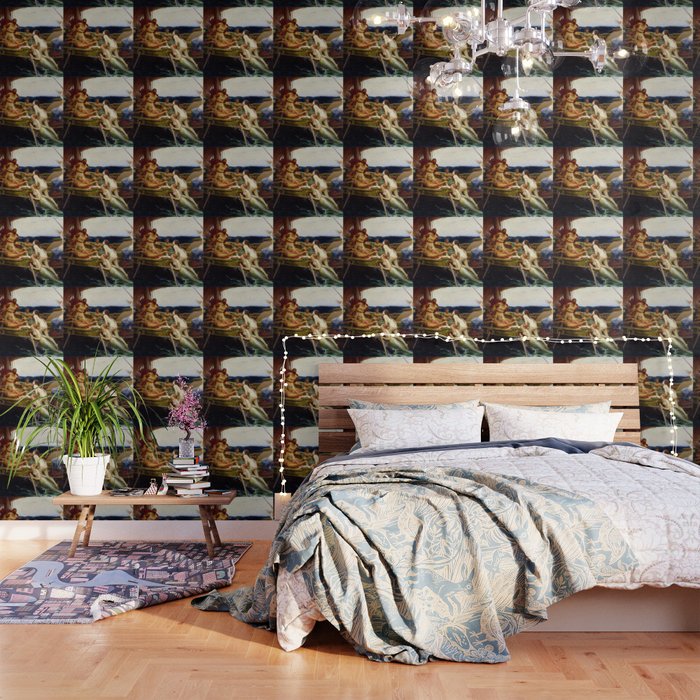
This screenshot has width=700, height=700. I want to click on vase, so click(90, 466).